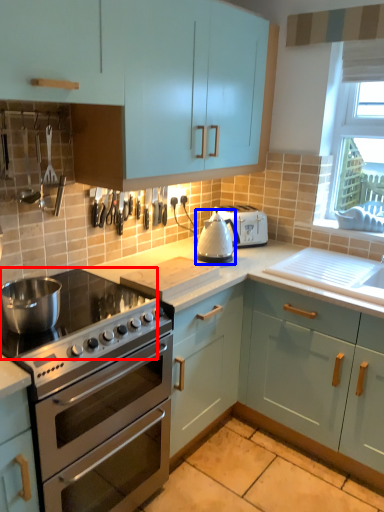
Question: Which object is further to the camera taking this photo, gas stove (highlighted by a red box) or appliance (highlighted by a blue box)?

Choices:
 (A) gas stove
 (B) appliance

Answer: (B)